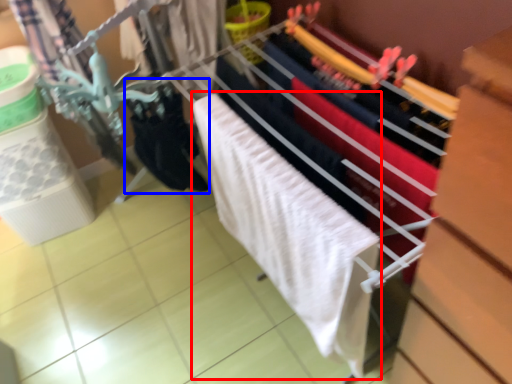
Question: Which object appears closest to the camera in this image, bath towel (highlighted by a red box) or clothing (highlighted by a blue box)?

Choices:
 (A) bath towel
 (B) clothing

Answer: (A)